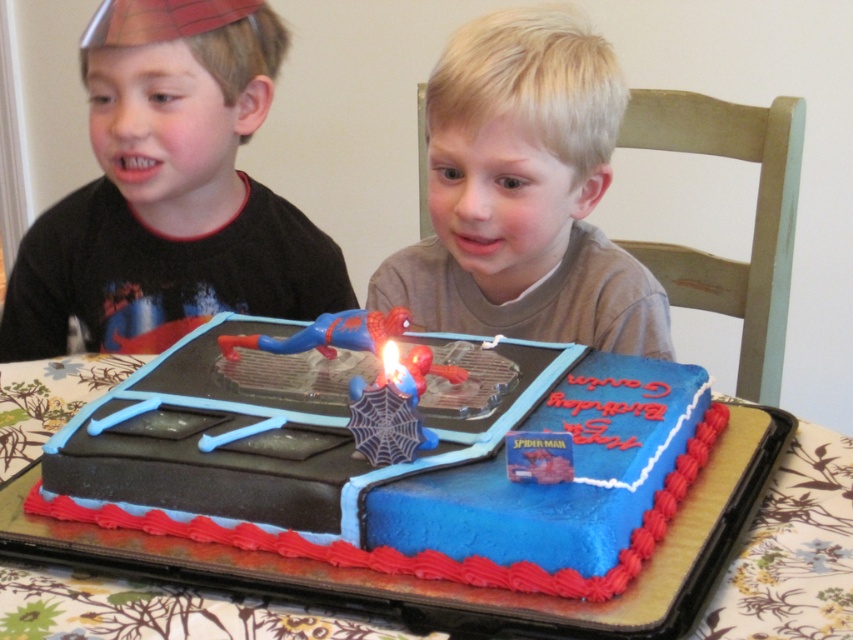
Is matte black shirt at left above blue frosted cake at center?

Yes.

The width and height of the screenshot is (853, 640). What do you see at coordinates (169, 192) in the screenshot? I see `matte black shirt at left` at bounding box center [169, 192].

Is point (91, 228) positioned before point (78, 604)?

No, it is behind (78, 604).

Locate an element on the screen. matte black shirt at left is located at coordinates (169, 192).

From the picture: Is blonde hair at upper center taller than blue frosted cake at center?

Yes.

Which is in front, point (556, 99) or point (811, 612)?

Point (811, 612) is more forward.

The image size is (853, 640). In order to click on blonde hair at upper center in this screenshot , I will do `click(524, 195)`.

Identify the location of matte black shirt at left. Image resolution: width=853 pixels, height=640 pixels. (169, 192).

The width and height of the screenshot is (853, 640). What do you see at coordinates (169, 192) in the screenshot? I see `matte black shirt at left` at bounding box center [169, 192].

The height and width of the screenshot is (640, 853). Identify the location of matte black shirt at left. (169, 192).